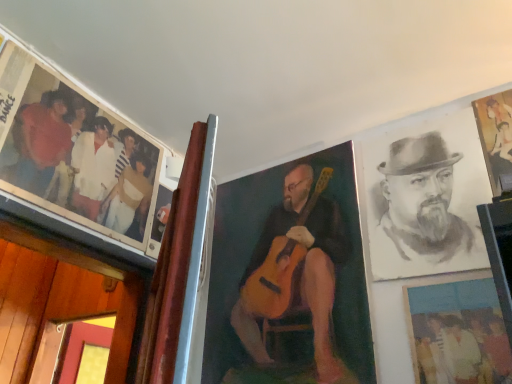
Question: Based on their sizes in the image, would you say matte black photo at upper left is bigger or smaller than gold metallic painting at upper right, positioned as the 1th picture frame in right-to-left order?

Choices:
 (A) small
 (B) big

Answer: (B)

Question: Is point (75, 205) positioned closer to the camera than point (501, 165)?

Choices:
 (A) closer
 (B) farther

Answer: (B)

Question: Estimate the real-world distances between objects in this image. Which object is closer to the matte black photo at upper left?

Choices:
 (A) wooden frame at center, the first picture frame in the left-to-right sequence
 (B) charcoal portrait of man at right
 (C) gold metallic painting at upper right, which is the third picture frame from left to right
 (D) matte plastic photo at lower right, acting as the second picture frame starting from the left

Answer: (A)

Question: Considering the real-world distances, which object is farthest from the wooden frame at center, the first picture frame in the left-to-right sequence?

Choices:
 (A) matte black photo at upper left
 (B) matte plastic photo at lower right, acting as the second picture frame starting from the left
 (C) charcoal portrait of man at right
 (D) gold metallic painting at upper right, which is the third picture frame from left to right

Answer: (D)